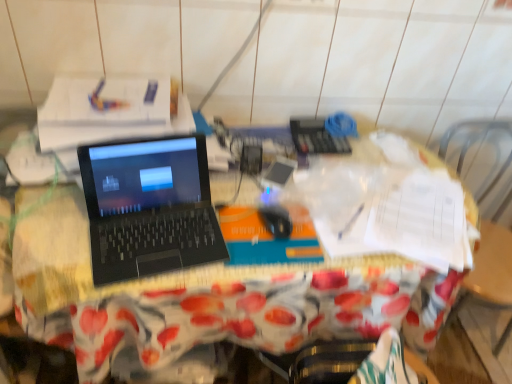
Image resolution: width=512 pixels, height=384 pixels. In order to click on free location to the left of black matte mouse at center in this screenshot , I will do `click(189, 231)`.